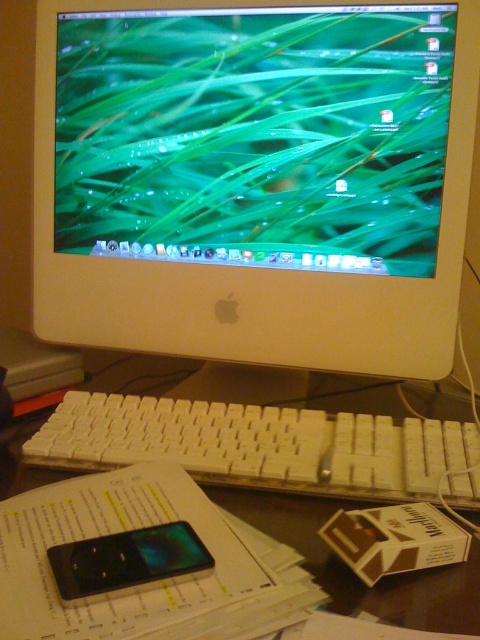
Is white plastic monitor at center smaller than white plastic keyboard at center?

Incorrect, white plastic monitor at center is not smaller in size than white plastic keyboard at center.

Is white plastic monitor at center to the right of white plastic keyboard at center from the viewer's perspective?

No, white plastic monitor at center is not to the right of white plastic keyboard at center.

This screenshot has height=640, width=480. Describe the element at coordinates (254, 179) in the screenshot. I see `white plastic monitor at center` at that location.

Where is `white plastic monitor at center`? Image resolution: width=480 pixels, height=640 pixels. white plastic monitor at center is located at coordinates (254, 179).

Which is more to the right, white plastic keyboard at center or white plastic keyboard at lower center?

white plastic keyboard at lower center is more to the right.

Describe the element at coordinates (264, 445) in the screenshot. I see `white plastic keyboard at center` at that location.

Locate an element on the screen. Image resolution: width=480 pixels, height=640 pixels. white plastic keyboard at center is located at coordinates (264, 445).

Can you confirm if white plastic monitor at center is positioned to the right of white plastic keyboard at lower center?

No, white plastic monitor at center is not to the right of white plastic keyboard at lower center.

Does point (68, 26) come closer to viewer compared to point (295, 500)?

No, (68, 26) is behind (295, 500).

What do you see at coordinates (254, 179) in the screenshot? Image resolution: width=480 pixels, height=640 pixels. I see `white plastic monitor at center` at bounding box center [254, 179].

Locate an element on the screen. The image size is (480, 640). white plastic monitor at center is located at coordinates (254, 179).